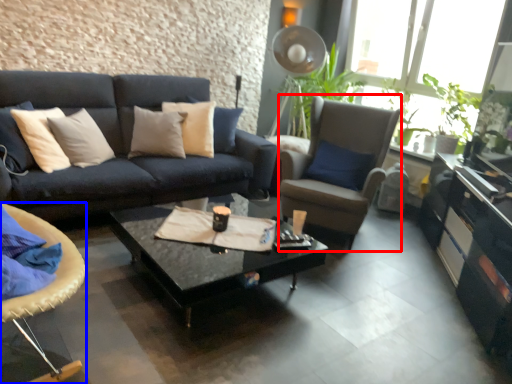
Question: Which object appears farthest to the camera in this image, chair (highlighted by a red box) or chair (highlighted by a blue box)?

Choices:
 (A) chair
 (B) chair

Answer: (A)